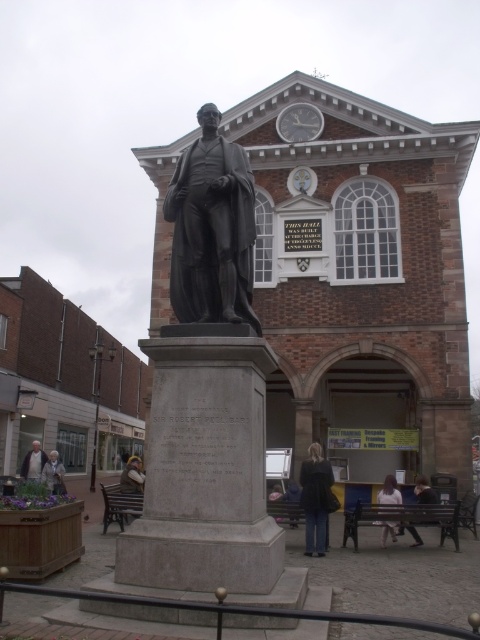
Is brown leather bag at lower left shorter than matte bronze statue at center?

Incorrect, brown leather bag at lower left's height does not fall short of matte bronze statue at center's.

At what (x,y) coordinates should I click in order to perform the action: click on brown leather bag at lower left. Please return your answer as a coordinate pair (x, y). Looking at the image, I should click on (132, 477).

The width and height of the screenshot is (480, 640). Describe the element at coordinates (132, 477) in the screenshot. I see `brown leather bag at lower left` at that location.

You are a GUI agent. You are given a task and a screenshot of the screen. Output one action in this format:
    pyautogui.click(x=<x>, y=<y>)
    Task: Click on the brown leather bag at lower left
    This screenshot has width=480, height=640.
    Given the screenshot: What is the action you would take?
    pyautogui.click(x=132, y=477)

Looking at this image, is dark blue jeans at lower center to the left of brown leather bag at lower left from the viewer's perspective?

Incorrect, dark blue jeans at lower center is not on the left side of brown leather bag at lower left.

Is dark blue jeans at lower center further to the viewer compared to brown leather bag at lower left?

No, it is not.

This screenshot has height=640, width=480. What do you see at coordinates (315, 499) in the screenshot?
I see `dark blue jeans at lower center` at bounding box center [315, 499].

Locate an element on the screen. This screenshot has height=640, width=480. dark blue jeans at lower center is located at coordinates (315, 499).

Identify the location of bronze statue at center. This screenshot has height=640, width=480. (360, 276).

The height and width of the screenshot is (640, 480). What are the coordinates of `bronze statue at center` in the screenshot? It's located at (360, 276).